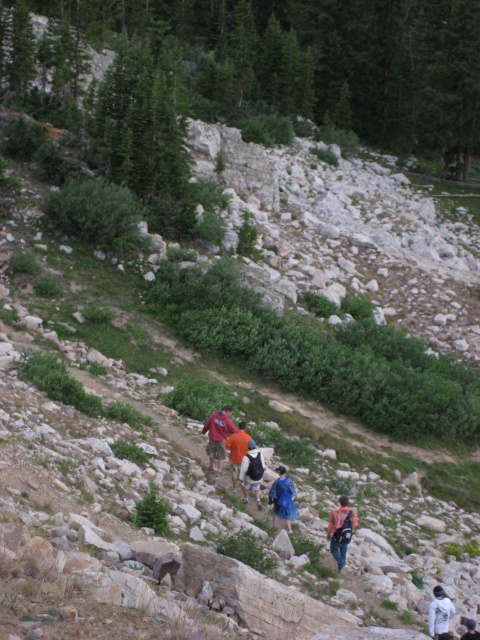
Based on the photo, can you confirm if denim jacket at lower center is positioned above blue fabric backpack at center?

Incorrect, denim jacket at lower center is not positioned above blue fabric backpack at center.

Is point (354, 513) more distant than point (279, 497)?

No, (354, 513) is closer to viewer.

What are the coordinates of `denim jacket at lower center` in the screenshot? It's located at (340, 529).

In the scene shown: Which is above, denim jacket at lower center or white cotton shirt at lower right?

Positioned higher is denim jacket at lower center.

Can you confirm if denim jacket at lower center is positioned to the right of white cotton shirt at lower right?

In fact, denim jacket at lower center is to the left of white cotton shirt at lower right.

Locate an element on the screen. denim jacket at lower center is located at coordinates (340, 529).

Identify the location of denim jacket at lower center. (340, 529).

Is denim jacket at lower center to the right of matte red shirt at center from the viewer's perspective?

Yes, denim jacket at lower center is to the right of matte red shirt at center.

Where is `denim jacket at lower center`? The width and height of the screenshot is (480, 640). denim jacket at lower center is located at coordinates (340, 529).

Where is `denim jacket at lower center`? The image size is (480, 640). denim jacket at lower center is located at coordinates click(340, 529).